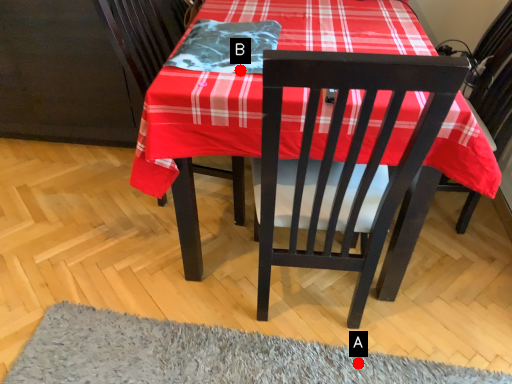
Question: Two points are circled on the image, labeled by A and B beside each circle. Which of the following is the closest to the observer?

Choices:
 (A) A is closer
 (B) B is closer

Answer: (B)